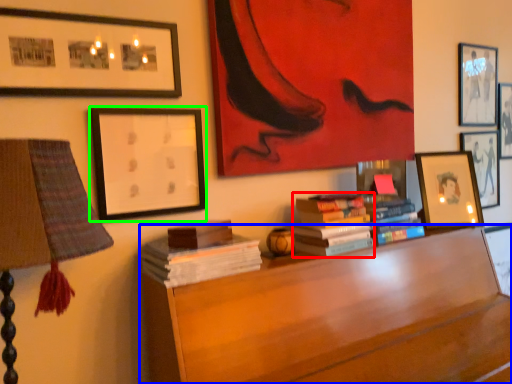
Question: Considering the real-world distances, which object is farthest from book (highlighted by a red box)? furniture (highlighted by a blue box) or picture frame (highlighted by a green box)?

Choices:
 (A) furniture
 (B) picture frame

Answer: (B)